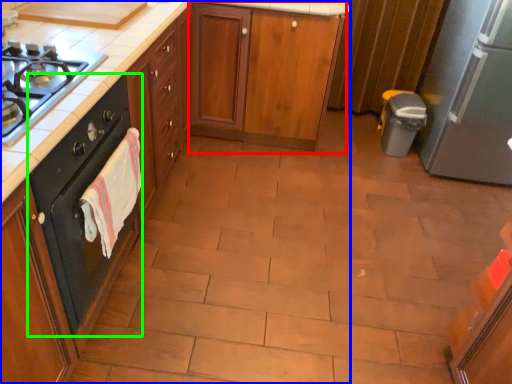
Question: Which object is the farthest from cabinetry (highlighted by a red box)? Choose among these: cabinetry (highlighted by a blue box) or home appliance (highlighted by a green box).

Choices:
 (A) cabinetry
 (B) home appliance

Answer: (B)